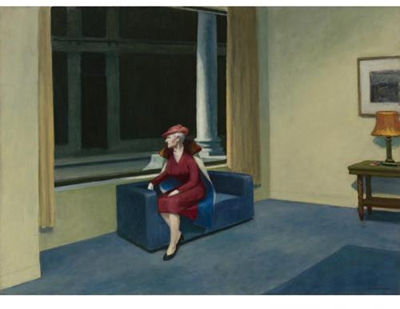
The image size is (400, 309). I want to click on loveseat, so click(x=241, y=204).